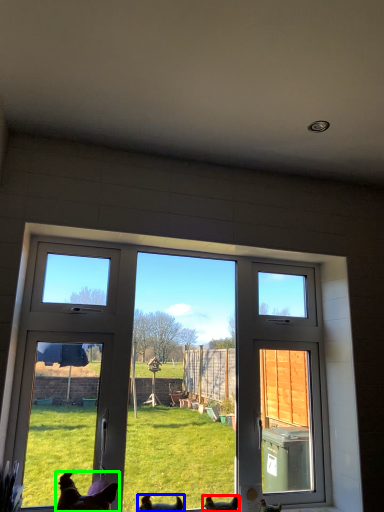
Question: Considering the real-world distances, which object is farthest from chicken (highlighted by a red box)? dog (highlighted by a blue box) or dog (highlighted by a green box)?

Choices:
 (A) dog
 (B) dog

Answer: (B)